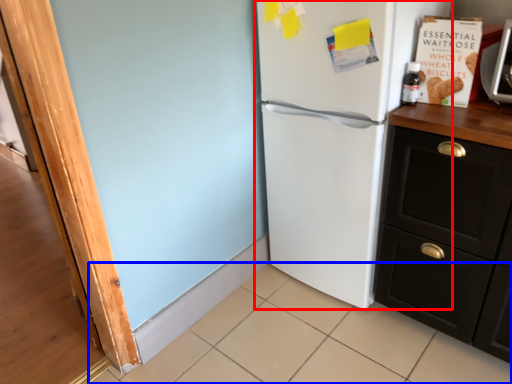
Question: Which object appears farthest to the camera in this image, refrigerator (highlighted by a red box) or tile (highlighted by a blue box)?

Choices:
 (A) refrigerator
 (B) tile

Answer: (A)